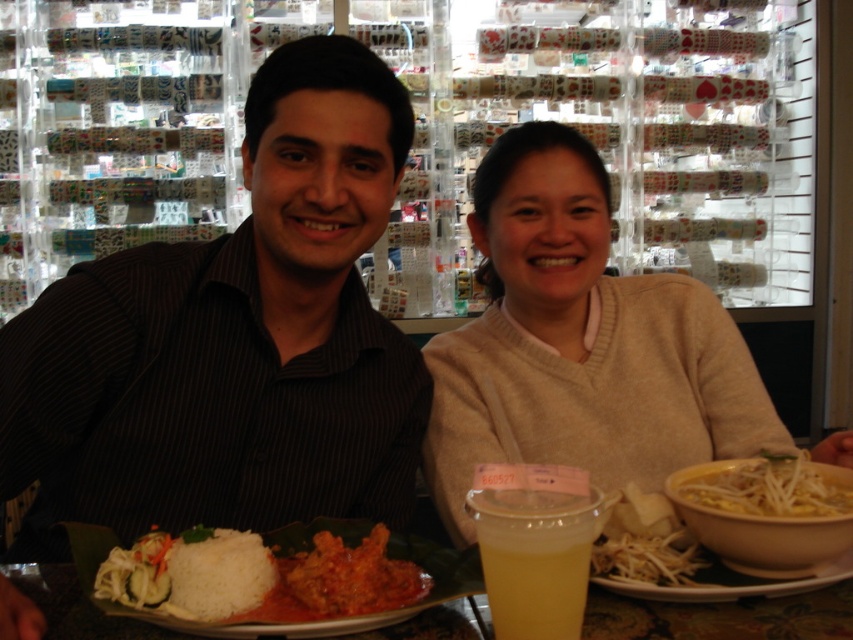
Based on the photo, does beige sweater at center have a smaller size compared to tomato sauce coated chicken at center?

No, beige sweater at center is not smaller than tomato sauce coated chicken at center.

Can you confirm if beige sweater at center is positioned to the right of tomato sauce coated chicken at center?

Yes, beige sweater at center is to the right of tomato sauce coated chicken at center.

Which is in front, point (621, 444) or point (410, 593)?

Point (410, 593)

Locate an element on the screen. This screenshot has height=640, width=853. beige sweater at center is located at coordinates (579, 342).

Between white matte rice at center and yellow matte bowl at lower right, which one is positioned lower?

white matte rice at center

Does white matte rice at center have a greater height compared to yellow matte bowl at lower right?

Yes, white matte rice at center is taller than yellow matte bowl at lower right.

Is point (310, 589) in front of point (808, 493)?

Yes.

Identify the location of white matte rice at center. This screenshot has height=640, width=853. (258, 577).

Based on the photo, is white matte rice at center smaller than yellow translucent noodles at lower center?

Incorrect, white matte rice at center is not smaller in size than yellow translucent noodles at lower center.

Which is above, white matte rice at center or yellow translucent noodles at lower center?

yellow translucent noodles at lower center

Identify the location of white matte rice at center. The width and height of the screenshot is (853, 640). (258, 577).